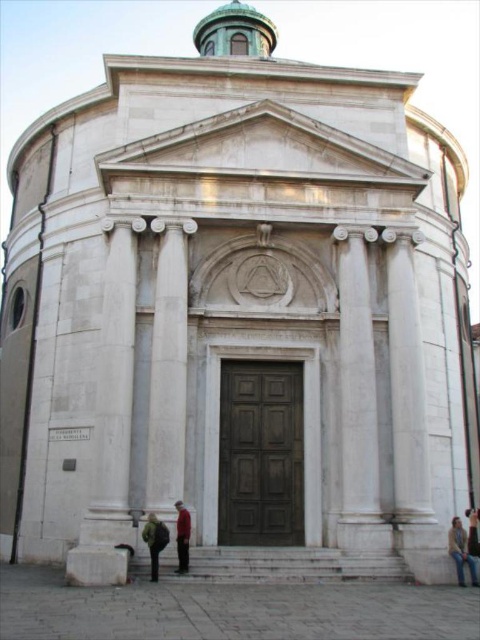
Consider the image. You are a delivery person with a large package that is 1.5 meters wide. You need to carry it up the white marble stairs at center while avoiding the light brown leather jacket at lower right. Can you fit the package through the space between the stairs and the jacket?

The white marble stairs at center is wider than the light brown leather jacket at lower right, so the 1.5 meter wide package can fit through the space between them as long as the total available width accommodates the package size.

You are standing in front of the classical building and see the green fuzzy coat at lower center. Where exactly is the green fuzzy coat located in relation to the main entrance?

The green fuzzy coat at lower center is located at coordinates point (155, 541), which is near the lower part of the building, closer to the main entrance.